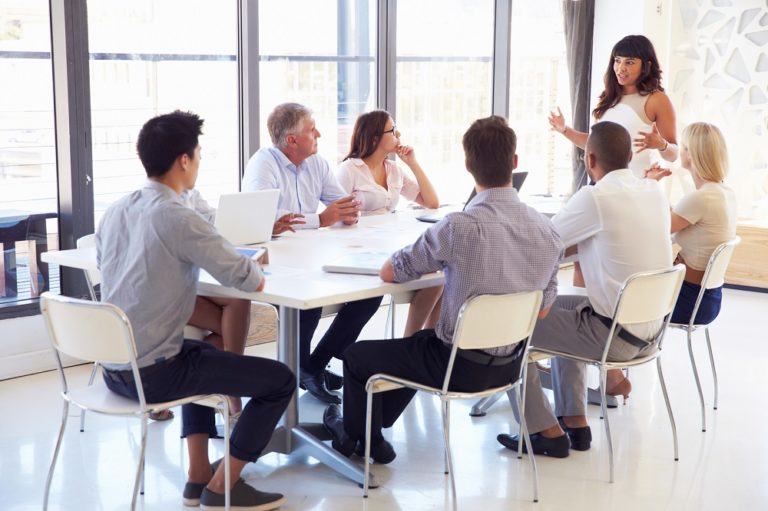
Where is `chairs`? This screenshot has height=511, width=768. chairs is located at coordinates (84, 343), (488, 338), (644, 317), (719, 256), (80, 237), (266, 307), (396, 297).